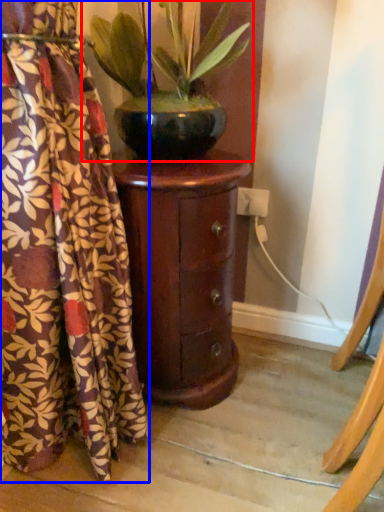
Question: Among these objects, which one is nearest to the camera, houseplant (highlighted by a red box) or curtain (highlighted by a blue box)?

Choices:
 (A) houseplant
 (B) curtain

Answer: (B)